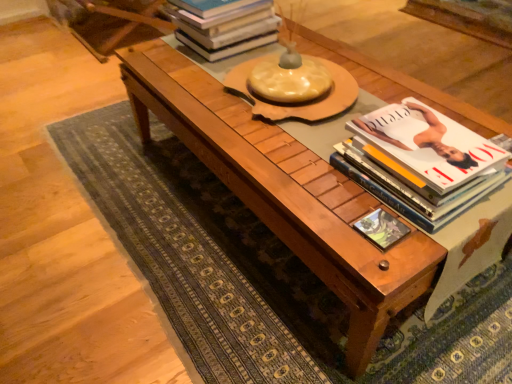
Where is `blank space situated above white glossy book at right, positioned as the second book in left-to-right order (from a real-world perspective)`? The width and height of the screenshot is (512, 384). blank space situated above white glossy book at right, positioned as the second book in left-to-right order (from a real-world perspective) is located at coordinates (417, 141).